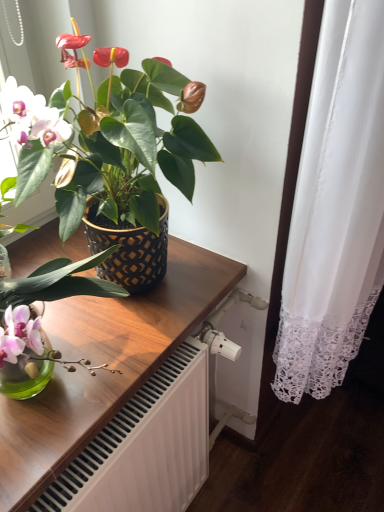
Question: Based on their sizes in the image, would you say wooden table at center is bigger or smaller than matte black pot at upper left?

Choices:
 (A) big
 (B) small

Answer: (B)

Question: Considering the positions of wooden table at center and matte black pot at upper left in the image, is wooden table at center wider or thinner than matte black pot at upper left?

Choices:
 (A) thin
 (B) wide

Answer: (A)

Question: From a real-world perspective, is wooden table at center above or below matte black pot at upper left?

Choices:
 (A) above
 (B) below

Answer: (B)

Question: Would you say matte black pot at upper left is to the left or to the right of wooden table at center in the picture?

Choices:
 (A) left
 (B) right

Answer: (B)

Question: Considering the positions of matte black pot at upper left and wooden table at center in the image, is matte black pot at upper left bigger or smaller than wooden table at center?

Choices:
 (A) big
 (B) small

Answer: (A)

Question: Does point (100, 167) appear closer or farther from the camera than point (46, 457)?

Choices:
 (A) farther
 (B) closer

Answer: (A)

Question: From a real-world perspective, is matte black pot at upper left positioned above or below wooden table at center?

Choices:
 (A) below
 (B) above

Answer: (B)